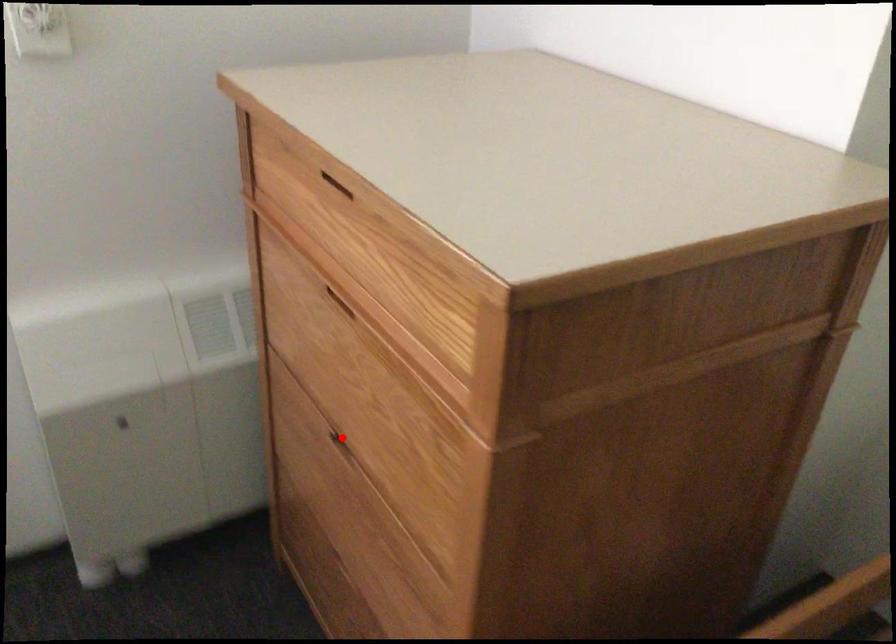
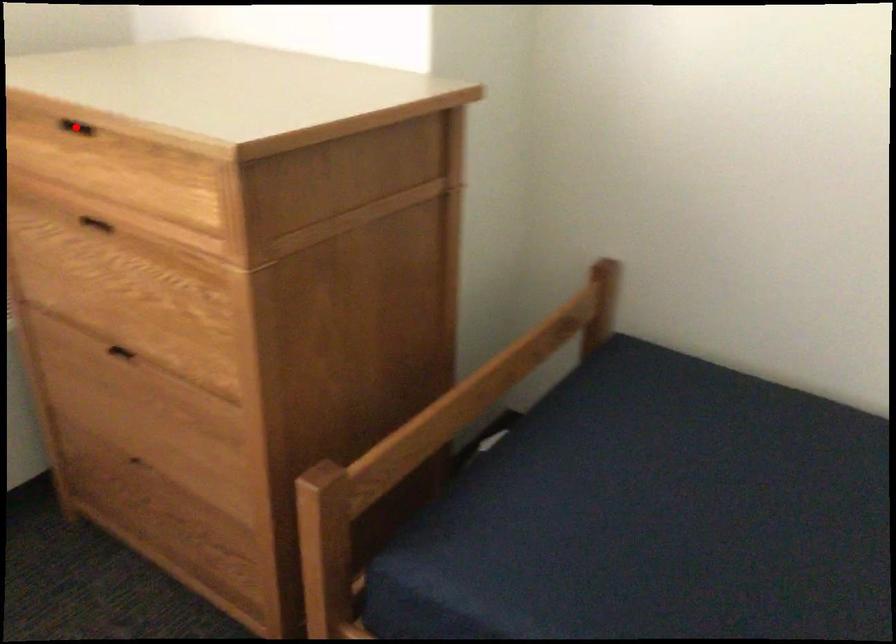
I am providing you with two images of the same scene from different viewpoints. A red point is marked on the first image and another point is marked on the second image. Is the red point in image1 aligned with the point shown in image2?

No